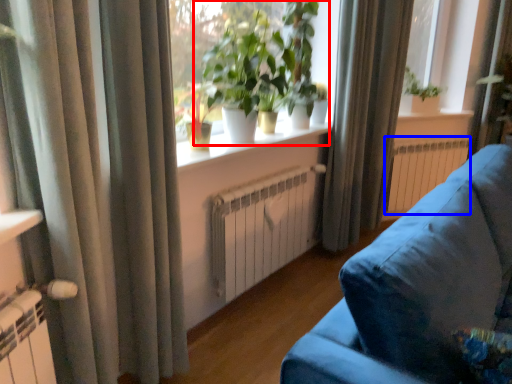
Question: Which object is further to the camera taking this photo, houseplant (highlighted by a red box) or radiator (highlighted by a blue box)?

Choices:
 (A) houseplant
 (B) radiator

Answer: (B)